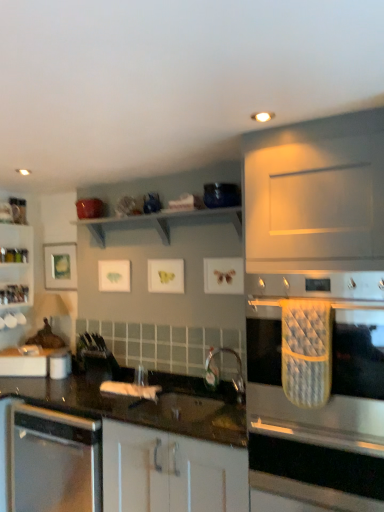
Find the location of `blue glossy bowl at upper center, placed as the 2th appliance when sorted from left to right`. blue glossy bowl at upper center, placed as the 2th appliance when sorted from left to right is located at coordinates (221, 195).

The width and height of the screenshot is (384, 512). Find the location of `metallic silver faucet at center`. metallic silver faucet at center is located at coordinates (219, 372).

This screenshot has height=512, width=384. I want to click on stainless steel oven mitt at right, so click(x=320, y=362).

What do you see at coordinates (60, 364) in the screenshot?
I see `white glossy canister at left, the 2th appliance positioned from the right` at bounding box center [60, 364].

At what (x,y) coordinates should I click in order to perform the action: click on blue glossy bowl at upper center, which ranks as the 1th appliance in top-to-bottom order. Please return your answer as a coordinate pair (x, y). Looking at the image, I should click on (221, 195).

From the image's perspective, is white glossy canister at left, the first appliance ordered from the bottom, under stainless steel oven mitt at right?

Yes.

From their relative heights in the image, would you say white glossy canister at left, which ranks as the 2th appliance in top-to-bottom order, is taller or shorter than stainless steel oven mitt at right?

white glossy canister at left, which ranks as the 2th appliance in top-to-bottom order, is shorter than stainless steel oven mitt at right.

From a real-world perspective, which object stands above the other?

stainless steel oven mitt at right is physically above.

Identify the location of home appliance above the white glossy canister at left, which ranks as the 2th appliance in top-to-bottom order (from a real-world perspective). (320, 362).

Considering the positions of objects metallic silver faucet at center and clear glass shelves at left in the image provided, who is in front, metallic silver faucet at center or clear glass shelves at left?

metallic silver faucet at center is more forward.

Where is `tap lying below the clear glass shelves at left (from the image's perspective)`? The image size is (384, 512). tap lying below the clear glass shelves at left (from the image's perspective) is located at coordinates pos(219,372).

Is metallic silver faucet at center inside the boundaries of clear glass shelves at left, or outside?

metallic silver faucet at center lies outside clear glass shelves at left.

Measure the distance from metallic silver faucet at center to clear glass shelves at left.

metallic silver faucet at center is 1.68 meters from clear glass shelves at left.

Is white glossy cabinet at center positioned with its back to clear glass shelves at left?

No, clear glass shelves at left is not at the back of white glossy cabinet at center.

In the image, is white glossy cabinet at center positioned in front of or behind clear glass shelves at left?

Clearly, white glossy cabinet at center is in front of clear glass shelves at left.

Is point (140, 504) more distant than point (25, 266)?

No.

Is metallic silver faucet at center oriented away from white glossy cabinet at center?

No, metallic silver faucet at center is not facing away from white glossy cabinet at center.

Can you see metallic silver faucet at center touching white glossy cabinet at center?

No, metallic silver faucet at center is not making contact with white glossy cabinet at center.

Is metallic silver faucet at center positioned beyond the bounds of white glossy cabinet at center?

Indeed, metallic silver faucet at center is completely outside white glossy cabinet at center.

Considering the sizes of metallic silver faucet at center and white glossy cabinet at center in the image, is metallic silver faucet at center taller or shorter than white glossy cabinet at center?

Clearly, metallic silver faucet at center is shorter compared to white glossy cabinet at center.

Considering the positions of objects blue glossy bowl at upper center, the first appliance positioned from the front, and white glossy canister at left, arranged as the first appliance when viewed from the back, in the image provided, who is more to the right, blue glossy bowl at upper center, the first appliance positioned from the front, or white glossy canister at left, arranged as the first appliance when viewed from the back,?

blue glossy bowl at upper center, the first appliance positioned from the front, is more to the right.

From the image's perspective, which is above, blue glossy bowl at upper center, positioned as the 1th appliance in right-to-left order, or white glossy canister at left, the first appliance ordered from the bottom?

blue glossy bowl at upper center, positioned as the 1th appliance in right-to-left order, from the image's perspective.

From a real-world perspective, is blue glossy bowl at upper center, positioned as the 1th appliance in right-to-left order, physically located above or below white glossy canister at left, the first appliance ordered from the bottom?

blue glossy bowl at upper center, positioned as the 1th appliance in right-to-left order, is situated higher than white glossy canister at left, the first appliance ordered from the bottom, in the real world.

Based on the photo, is blue glossy bowl at upper center, the 2th appliance from the bottom, directly adjacent to white glossy canister at left, which ranks as the 2th appliance in top-to-bottom order?

No, blue glossy bowl at upper center, the 2th appliance from the bottom, is not in contact with white glossy canister at left, which ranks as the 2th appliance in top-to-bottom order.

From their relative heights in the image, would you say blue glossy bowl at upper center, the 2th appliance from the bottom, is taller or shorter than clear glass shelves at left?

In the image, blue glossy bowl at upper center, the 2th appliance from the bottom, appears to be shorter than clear glass shelves at left.

From the image's perspective, is blue glossy bowl at upper center, placed as the 2th appliance when sorted from left to right, located above or below clear glass shelves at left?

Based on their image positions, blue glossy bowl at upper center, placed as the 2th appliance when sorted from left to right, is located above clear glass shelves at left.

Could you tell me if blue glossy bowl at upper center, placed as the 2th appliance when sorted from left to right, is facing clear glass shelves at left?

No, blue glossy bowl at upper center, placed as the 2th appliance when sorted from left to right, does not turn towards clear glass shelves at left.

Considering the sizes of stainless steel oven mitt at right and metallic silver faucet at center in the image, is stainless steel oven mitt at right wider or thinner than metallic silver faucet at center?

Clearly, stainless steel oven mitt at right has more width compared to metallic silver faucet at center.

From the image's perspective, is stainless steel oven mitt at right on metallic silver faucet at center?

Correct, stainless steel oven mitt at right appears higher than metallic silver faucet at center in the image.

Does stainless steel oven mitt at right have a lesser height compared to metallic silver faucet at center?

No.

Where is `appliance that is the 2nd object located behind the stainless steel oven mitt at right`? This screenshot has width=384, height=512. appliance that is the 2nd object located behind the stainless steel oven mitt at right is located at coordinates (60, 364).

You are a GUI agent. You are given a task and a screenshot of the screen. Output one action in this format:
    pyautogui.click(x=<x>, y=<y>)
    Task: Click on the tap that is below the clear glass shelves at left (from the image's perspective)
    The height and width of the screenshot is (512, 384).
    Given the screenshot: What is the action you would take?
    pyautogui.click(x=219, y=372)

Looking at the image, which one is located closer to metallic silver faucet at center, stainless steel oven mitt at right or white glossy cabinet at center?

The object closer to metallic silver faucet at center is white glossy cabinet at center.

Estimate the real-world distances between objects in this image. Which object is closer to clear glass shelves at left, metallic silver faucet at center or stainless steel oven mitt at right?

metallic silver faucet at center is positioned closer to the anchor clear glass shelves at left.

Estimate the real-world distances between objects in this image. Which object is closer to metallic silver faucet at center, satin black countertop at lower left or clear glass shelves at left?

Among the two, satin black countertop at lower left is located nearer to metallic silver faucet at center.

Consider the image. Estimate the real-world distances between objects in this image. Which object is further from white glossy canister at left, arranged as the first appliance when viewed from the back, stainless steel oven mitt at right or blue glossy bowl at upper center, the first appliance positioned from the front?

stainless steel oven mitt at right is positioned further to the anchor white glossy canister at left, arranged as the first appliance when viewed from the back.

Based on the photo, estimate the real-world distances between objects in this image. Which object is closer to clear glass shelves at left, metallic silver faucet at center or satin black countertop at lower left?

Based on the image, satin black countertop at lower left appears to be nearer to clear glass shelves at left.

Looking at the image, which one is located closer to clear glass shelves at left, satin black countertop at lower left or blue glossy bowl at upper center, placed as the 2th appliance when sorted from left to right?

satin black countertop at lower left is positioned closer to the anchor clear glass shelves at left.

From the image, which object appears to be farther from metallic silver faucet at center, blue glossy bowl at upper center, which ranks as the 1th appliance in top-to-bottom order, or clear glass shelves at left?

clear glass shelves at left.

Looking at this image, looking at the image, which one is located closer to white glossy cabinet at center, metallic silver faucet at center or clear glass shelves at left?

Among the two, metallic silver faucet at center is located nearer to white glossy cabinet at center.

Where is `cabinetry between clear glass shelves at left and blue glossy bowl at upper center, the first appliance positioned from the front`? cabinetry between clear glass shelves at left and blue glossy bowl at upper center, the first appliance positioned from the front is located at coordinates (170, 472).

Find the location of a particular element. The height and width of the screenshot is (512, 384). cabinetry between white glossy canister at left, arranged as the first appliance when viewed from the left, and metallic silver faucet at center from left to right is located at coordinates (170, 472).

What are the coordinates of `countertop between clear glass shelves at left and stainless steel oven mitt at right in the horizontal direction` in the screenshot? It's located at (118, 450).

This screenshot has width=384, height=512. Identify the location of home appliance that lies between blue glossy bowl at upper center, positioned as the 1th appliance in right-to-left order, and satin black countertop at lower left from top to bottom. (320, 362).